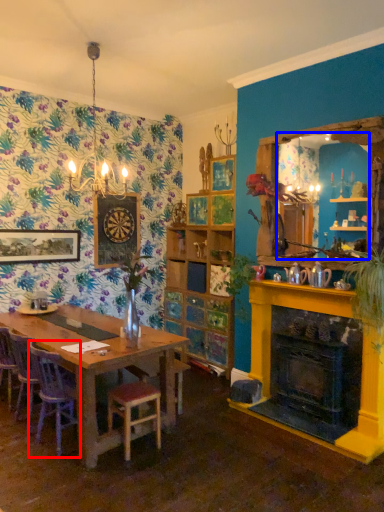
Question: Which point is closer to the camera, chair (highlighted by a red box) or mirror (highlighted by a blue box)?

Choices:
 (A) chair
 (B) mirror

Answer: (A)